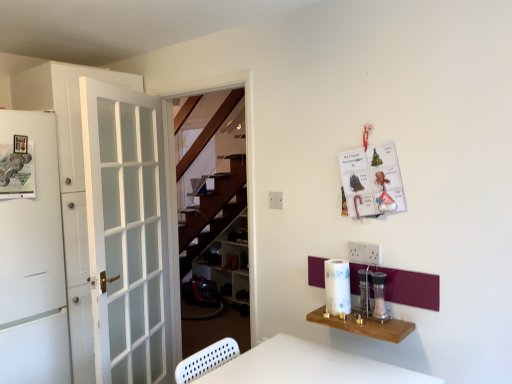
Identify the location of free space to the left of metallic silver salt and pepper shakers at center right, which appears as the 2th appliance when viewed from the right. The image size is (512, 384). (346, 314).